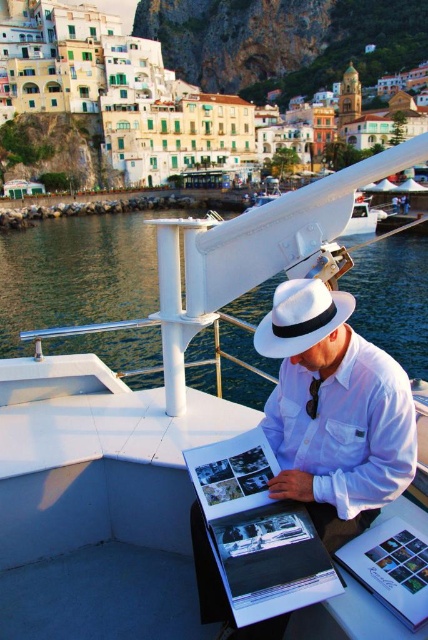
Is clear blue water at center closer to camera compared to black satin tie at center?

No, clear blue water at center is behind black satin tie at center.

Which is more to the right, clear blue water at center or black satin tie at center?

black satin tie at center is more to the right.

The image size is (428, 640). In order to click on clear blue water at center in this screenshot , I will do `click(74, 275)`.

I want to click on clear blue water at center, so click(x=74, y=275).

You are a GUI agent. You are given a task and a screenshot of the screen. Output one action in this format:
    pyautogui.click(x=<x>, y=<y>)
    Task: Click on the white cotton shirt at center
    Image resolution: width=428 pixels, height=640 pixels.
    Given the screenshot: What is the action you would take?
    pyautogui.click(x=333, y=412)

Find the location of a particular element. The width and height of the screenshot is (428, 640). white cotton shirt at center is located at coordinates (333, 412).

Is clear blue water at center wider than white cotton shirt at center?

Yes.

Is point (77, 228) more distant than point (344, 531)?

That is True.

Image resolution: width=428 pixels, height=640 pixels. Describe the element at coordinates (74, 275) in the screenshot. I see `clear blue water at center` at that location.

Where is `clear blue water at center`? Image resolution: width=428 pixels, height=640 pixels. clear blue water at center is located at coordinates coord(74,275).